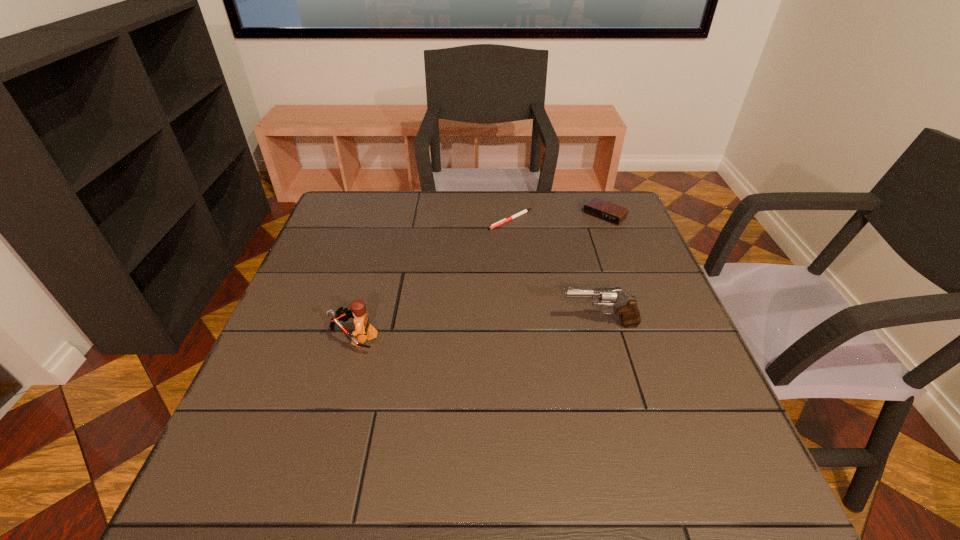
Find the location of `free spot on the desktop that is between the Lego and the pistol and is positioned on the clicker of the second object from left to right`. free spot on the desktop that is between the Lego and the pistol and is positioned on the clicker of the second object from left to right is located at coordinates (451, 333).

Locate an element on the screen. vacant space on the desktop that is between the leftmost object and the pistol and is positioned on the front face of the alarm clock is located at coordinates (483, 331).